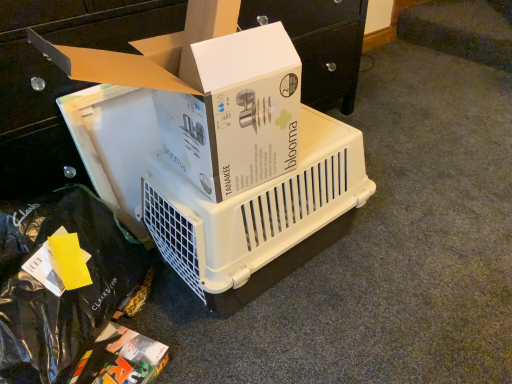
Question: Is white cardboard box at upper center, positioned as the third box in bottom-to-top order, bigger or smaller than white plastic crate at center, acting as the 2th box starting from the bottom?

Choices:
 (A) big
 (B) small

Answer: (B)

Question: Relative to white plastic crate at center, the 2th box in the top-to-bottom sequence, is white cardboard box at upper center, positioned as the third box in bottom-to-top order, in front or behind?

Choices:
 (A) behind
 (B) front

Answer: (A)

Question: Which object is the farthest from the white plastic pet carrier at center?

Choices:
 (A) white plastic crate at center, acting as the 2th box starting from the bottom
 (B) white cardboard box at upper center, positioned as the third box in bottom-to-top order
 (C) multicolored cardboard box at lower left, placed as the first box when sorted from bottom to top
 (D) black plastic bag at lower left

Answer: (C)

Question: Estimate the real-world distances between objects in this image. Which object is closer to the white plastic crate at center, the 2th box in the top-to-bottom sequence?

Choices:
 (A) multicolored cardboard box at lower left, the third box positioned from the top
 (B) white plastic pet carrier at center
 (C) white cardboard box at upper center, the 1th box positioned from the top
 (D) black plastic bag at lower left

Answer: (C)